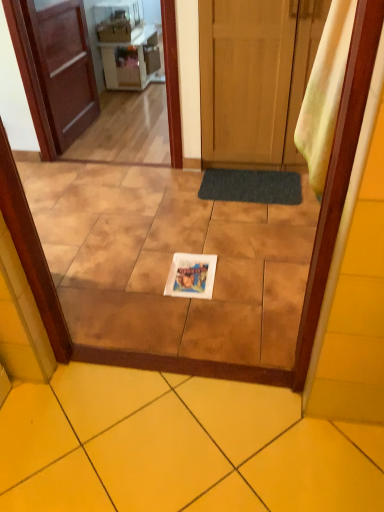
Question: Does wooden door at center, the 2th door viewed from the left, have a greater width compared to matte white microwave at upper center, positioned as the first appliance in left-to-right order?

Choices:
 (A) no
 (B) yes

Answer: (B)

Question: Does wooden door at center, which is the first door from right to left, lie in front of matte white microwave at upper center, which ranks as the 1th appliance in front-to-back order?

Choices:
 (A) yes
 (B) no

Answer: (A)

Question: Is wooden door at center, which is the first door from right to left, outside matte white microwave at upper center, positioned as the 2th appliance in right-to-left order?

Choices:
 (A) no
 (B) yes

Answer: (B)

Question: Does wooden door at center, the 2th door viewed from the left, turn towards matte white microwave at upper center, the 2th appliance when ordered from back to front?

Choices:
 (A) yes
 (B) no

Answer: (B)

Question: Can you confirm if wooden door at center, the 2th door viewed from the left, is smaller than matte white microwave at upper center, positioned as the first appliance in left-to-right order?

Choices:
 (A) no
 (B) yes

Answer: (A)

Question: Is brown wooden door at left, which is the second door from right to left, bigger or smaller than yellow ceramic tile at center, positioned as the 2th ceramic tile in back-to-front order?

Choices:
 (A) small
 (B) big

Answer: (B)

Question: In terms of width, does brown wooden door at left, which appears as the first door when viewed from the left, look wider or thinner when compared to yellow ceramic tile at center, acting as the first ceramic tile starting from the front?

Choices:
 (A) thin
 (B) wide

Answer: (A)

Question: Considering the positions of point (39, 59) and point (367, 465), is point (39, 59) closer or farther from the camera than point (367, 465)?

Choices:
 (A) closer
 (B) farther

Answer: (B)

Question: In the image, is brown wooden door at left, which is the second door from right to left, positioned in front of or behind yellow ceramic tile at center, positioned as the 2th ceramic tile in back-to-front order?

Choices:
 (A) front
 (B) behind

Answer: (B)

Question: Is point coord(48,192) positioned closer to the camera than point coord(324,153)?

Choices:
 (A) closer
 (B) farther

Answer: (B)

Question: From a real-world perspective, relative to yellow fabric curtain at right, is white glossy plate at center, positioned as the 1th ceramic tile in top-to-bottom order, vertically above or below?

Choices:
 (A) above
 (B) below

Answer: (B)

Question: In the image, is white glossy plate at center, positioned as the 1th ceramic tile in top-to-bottom order, positioned in front of or behind yellow fabric curtain at right?

Choices:
 (A) behind
 (B) front

Answer: (A)

Question: Is white glossy plate at center, which is the 2th ceramic tile in bottom-to-top order, inside the boundaries of yellow fabric curtain at right, or outside?

Choices:
 (A) inside
 (B) outside

Answer: (B)

Question: Visually, is brown wooden door at left, which appears as the first door when viewed from the left, positioned to the left or to the right of brown wooden screen door at upper left?

Choices:
 (A) left
 (B) right

Answer: (A)

Question: Considering the positions of brown wooden door at left, which appears as the first door when viewed from the left, and brown wooden screen door at upper left in the image, is brown wooden door at left, which appears as the first door when viewed from the left, taller or shorter than brown wooden screen door at upper left?

Choices:
 (A) short
 (B) tall

Answer: (A)